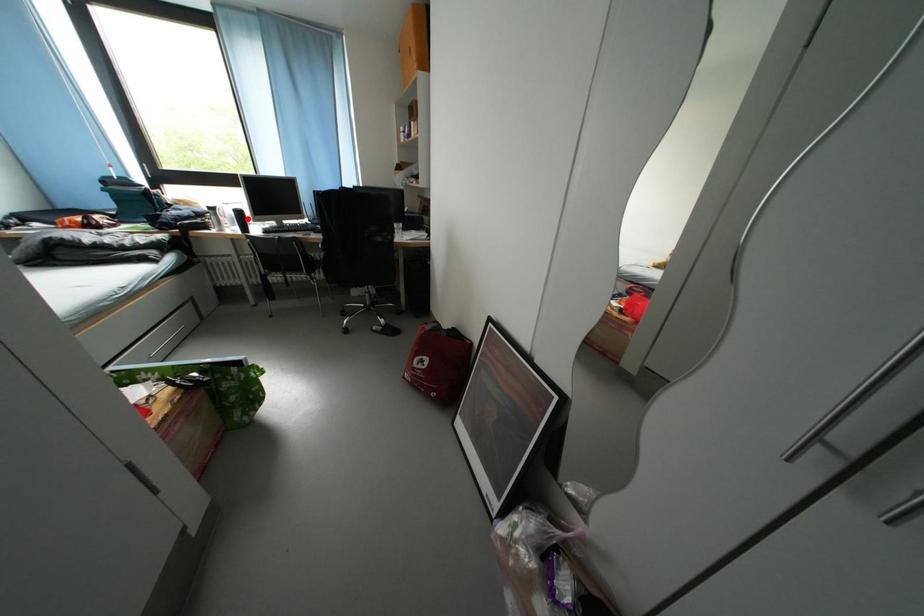
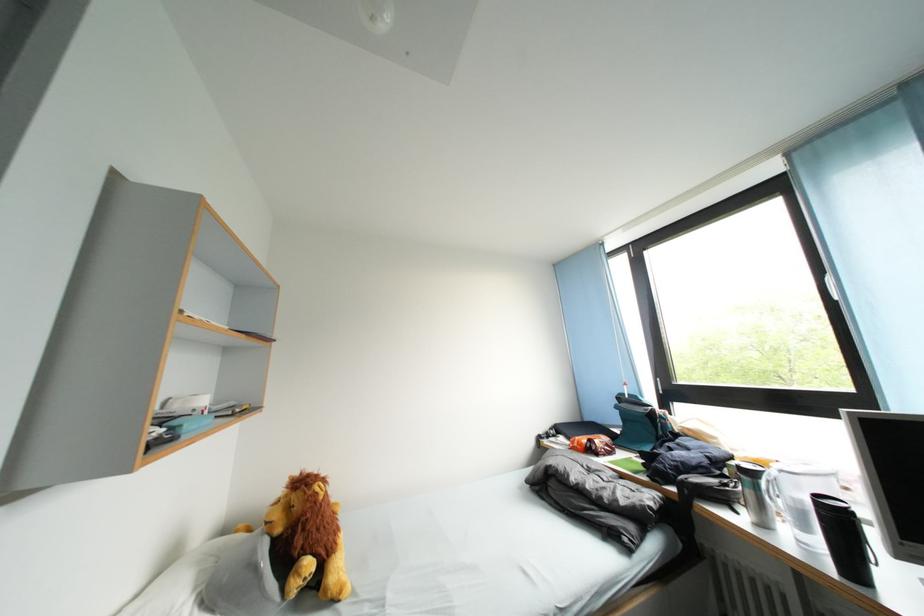
Where in the second image is the point corresponding to the highlighted location from the first image?

(844, 522)